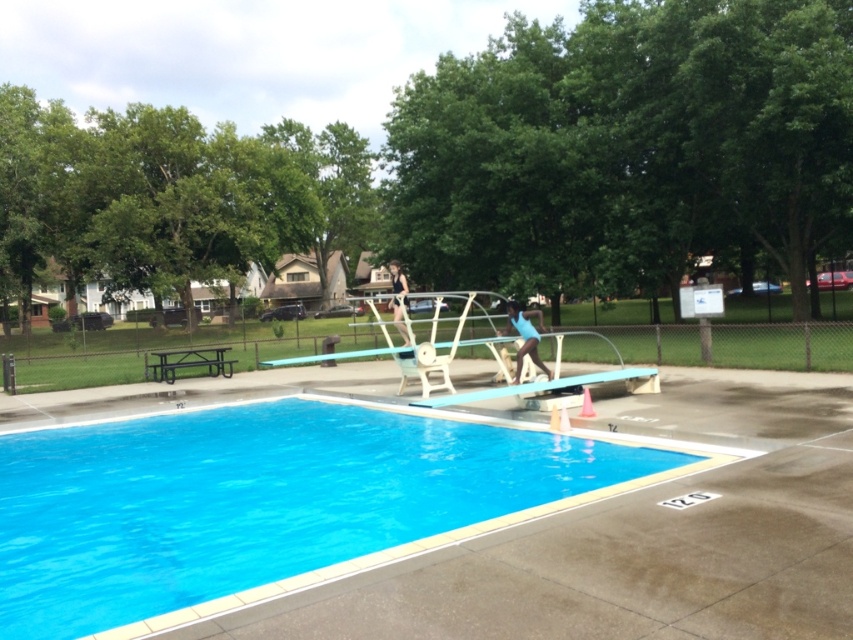
You are a maintenance worker who needs to reach the blue smooth pool at center from the black metal picnic table at lower left to clean it. Can you walk directly to the pool without any obstacles? The maintenance cart you are using is 1.2 meters wide. Is the path between them wide enough for your cart?

The distance between the blue smooth pool at center and the black metal picnic table at lower left is 9.19 meters. Since the path width isn not specified in the objects description, but the distance between them is over 9 meters, it is likely that the path is wide enough for the 1.2 meter wide maintenance cart to navigate. However, without explicit path width details, this is an assumption based on typical pool area layouts.

You are standing at the edge of the diving board in the pool area. If you look straight ahead, will you see the green leafy tree at upper center?

Yes, the green leafy tree at upper center is located at point (628, 147), so when standing at the diving board edge and looking straight ahead, you would see it directly in front of you.